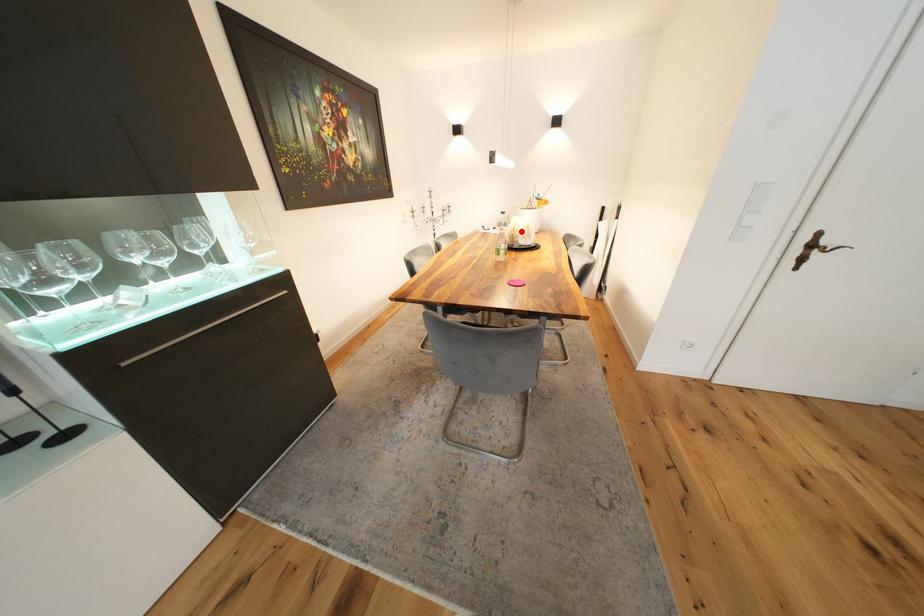
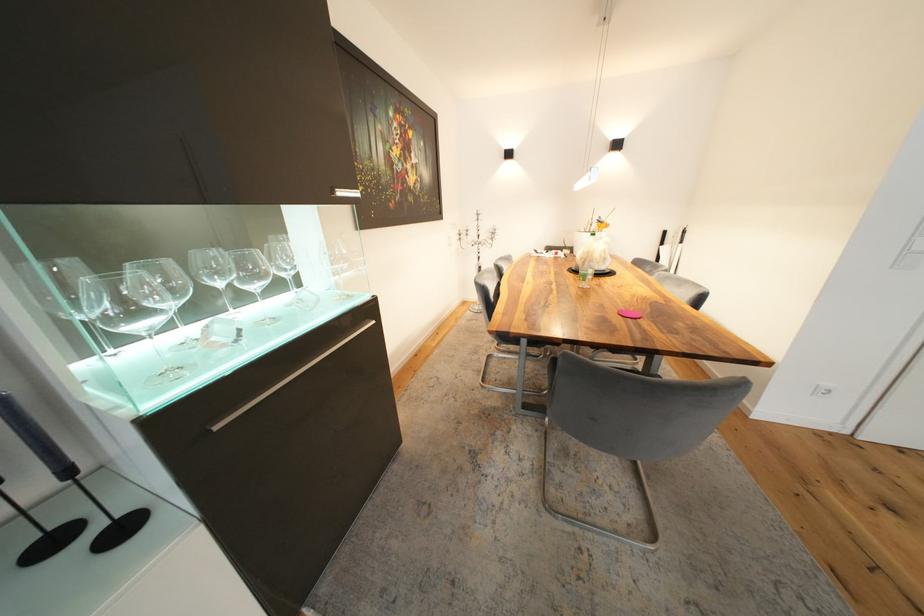
Locate, in the second image, the point that corresponds to the highlighted location in the first image.

(594, 254)